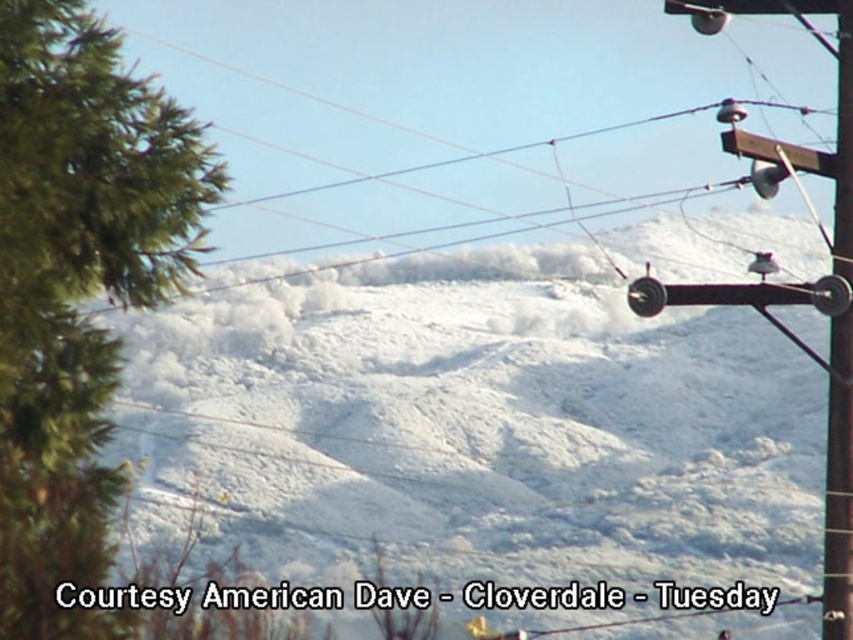
Between point (315, 115) and point (97, 477), which one is positioned behind?

Positioned behind is point (315, 115).

Measure the distance between point (x=642, y=100) and camera.

Point (x=642, y=100) and camera are 95.89 meters apart from each other.

Where is `metallic wire at upper right`? metallic wire at upper right is located at coordinates (451, 104).

You are a GUI agent. You are given a task and a screenshot of the screen. Output one action in this format:
    pyautogui.click(x=<x>, y=<y>)
    Task: Click on the metallic wire at upper right
    
    Given the screenshot: What is the action you would take?
    pyautogui.click(x=451, y=104)

Between point (276, 145) and point (846, 156), which one is positioned in front?

Point (846, 156) is more forward.

Does metallic wire at upper right have a larger size compared to brown wooden telegraph pole at upper right?

Yes, metallic wire at upper right is bigger than brown wooden telegraph pole at upper right.

What do you see at coordinates (451, 104) in the screenshot? The width and height of the screenshot is (853, 640). I see `metallic wire at upper right` at bounding box center [451, 104].

Locate an element on the screen. The width and height of the screenshot is (853, 640). metallic wire at upper right is located at coordinates (451, 104).

Can you confirm if green textured tree at left is positioned to the left of brown wooden telegraph pole at upper right?

Indeed, green textured tree at left is positioned on the left side of brown wooden telegraph pole at upper right.

Does green textured tree at left come behind brown wooden telegraph pole at upper right?

No, green textured tree at left is in front of brown wooden telegraph pole at upper right.

Measure the distance between point (167, 99) and camera.

Point (167, 99) is 16.45 meters away from camera.

Find the location of a particular element. The width and height of the screenshot is (853, 640). green textured tree at left is located at coordinates (76, 285).